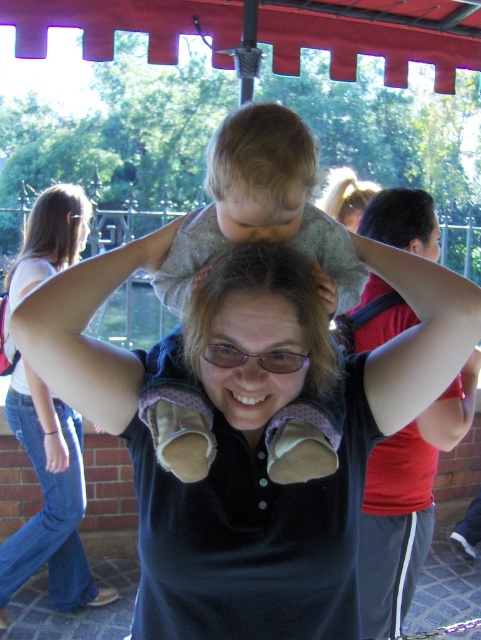
You are a photographer trying to capture a candid shot of the matte black hair at center and the blonde hair at upper center. Which person should you focus on first if you want to photograph the one closer to the camera?

The matte black hair at center is below blonde hair at upper center, so the blonde hair at upper center is closer to the camera. You should focus on the blonde hair at upper center first.

You are a photographer trying to capture a candid shot of the scene. You notice the matte black shirt at center and the matte black hair at center. Which object should you focus on first if you want to ensure both are in focus, considering their sizes in the frame?

The matte black shirt at center has a greater height compared to matte black hair at center, so focusing on the larger matte black shirt at center first would help ensure both are in focus.

You are a photographer trying to capture a candid shot of the matte black shirt at center and the blonde hair at upper left. The camera has a maximum focus range of 30 inches. Will you be able to focus on both subjects at the same time?

The matte black shirt at center is 32.03 inches from the blonde hair at upper left. Since the distance between them exceeds the camera maximum focus range of 30 inches, you won both subjects at the same time.